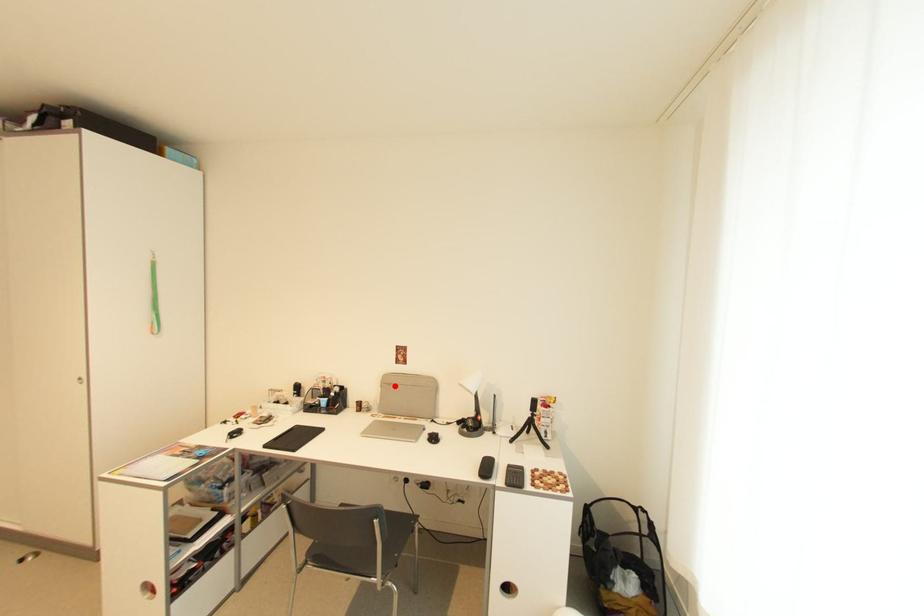
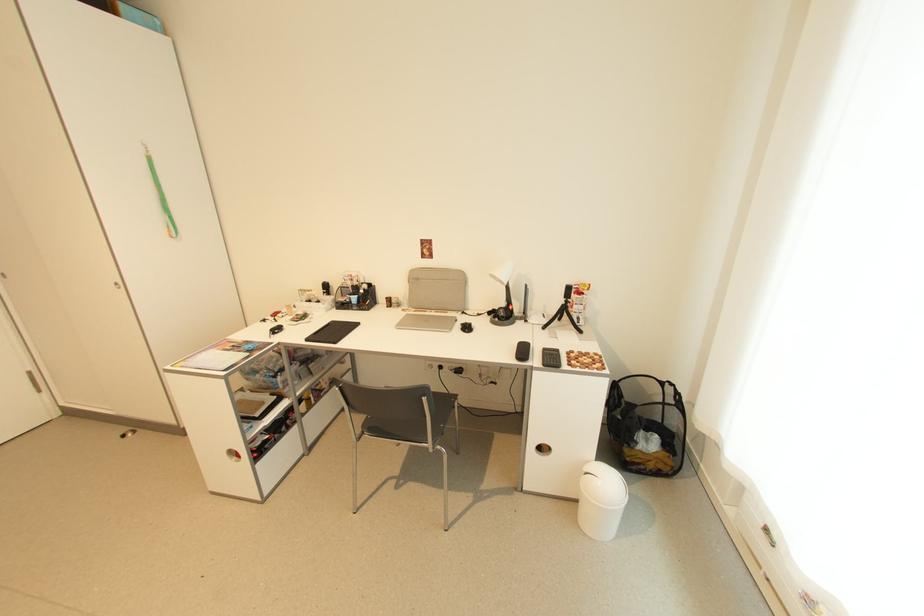
Question: I am providing you with two images of the same scene from different viewpoints. In image1, a red point is highlighted. Considering the same 3D point in image2, which of the following is correct?

Choices:
 (A) It is closer
 (B) It is farther

Answer: (A)